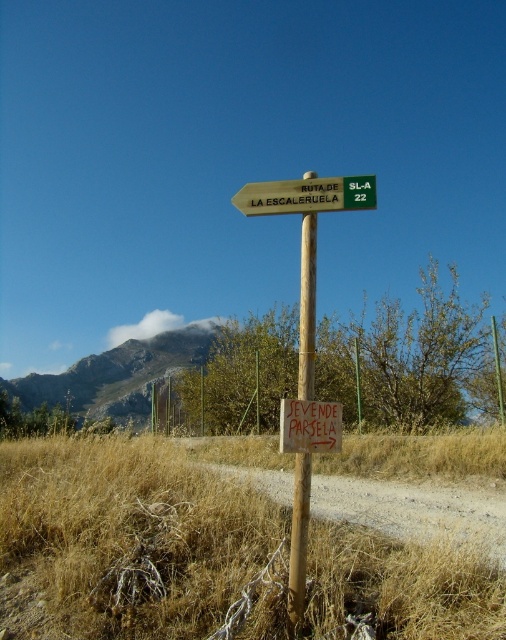
Question: Which point is closer to the camera taking this photo?

Choices:
 (A) (355, 204)
 (B) (297, 604)
 (C) (502, 513)
 (D) (339, 432)

Answer: (B)

Question: Among these objects, which one is nearest to the camera?

Choices:
 (A) brown dirt track at center
 (B) green plastic signpost at center

Answer: (B)

Question: Is brown dirt track at center bigger than green plastic signpost at center?

Choices:
 (A) no
 (B) yes

Answer: (B)

Question: Which object is closer to the camera taking this photo?

Choices:
 (A) white paper sign at center
 (B) dry straw at lower center
 (C) brown dirt track at center
 (D) brown wooden pole at center

Answer: (B)

Question: Can you confirm if brown dirt track at center is positioned to the left of green plastic signpost at center?

Choices:
 (A) no
 (B) yes

Answer: (A)

Question: Considering the relative positions of dry straw at lower center and white paper sign at center in the image provided, where is dry straw at lower center located with respect to white paper sign at center?

Choices:
 (A) above
 (B) below

Answer: (B)